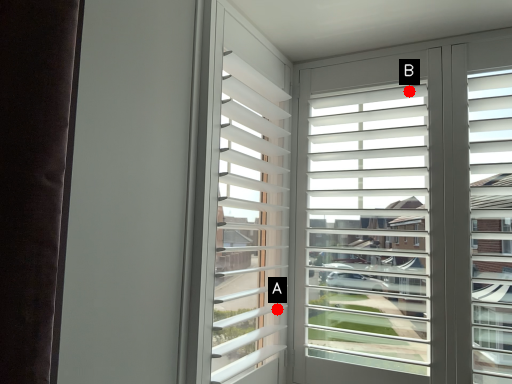
Question: Two points are circled on the image, labeled by A and B beside each circle. Which of the following is the closest to the observer?

Choices:
 (A) A is closer
 (B) B is closer

Answer: (B)